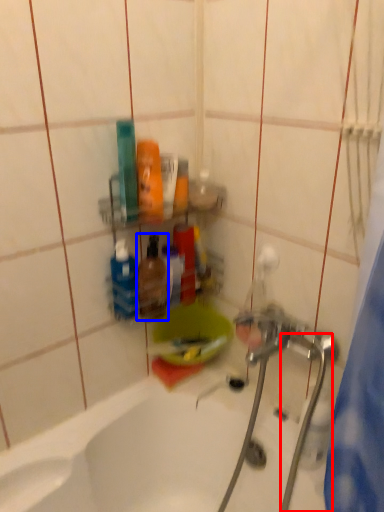
Question: Which point is further to the camera, water pipe (highlighted by a red box) or mouthwash (highlighted by a blue box)?

Choices:
 (A) water pipe
 (B) mouthwash

Answer: (B)